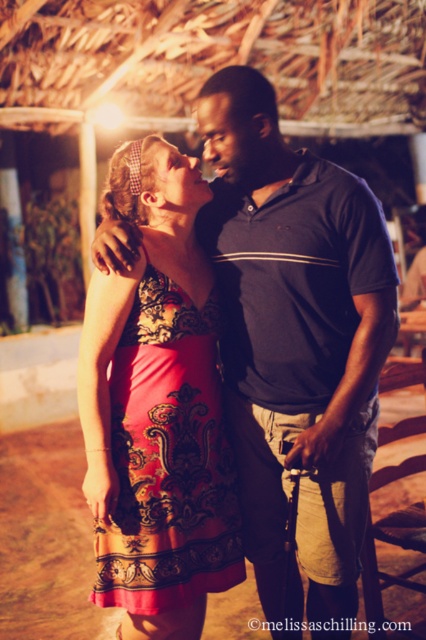
What is the color of the clothing item located at the coordinates point (298, 342)?

The point (298, 342) corresponds to the matte black shirt at center, so the color is black.